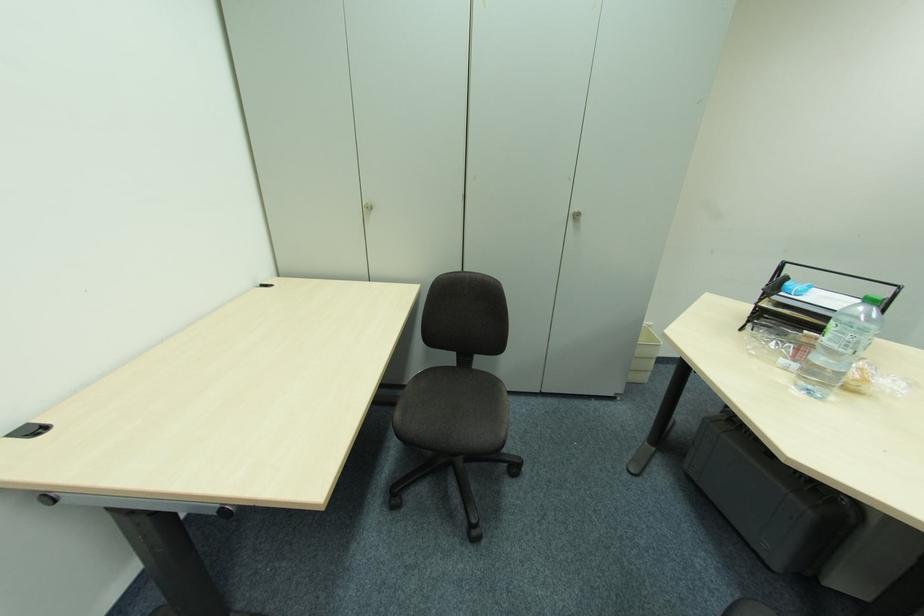
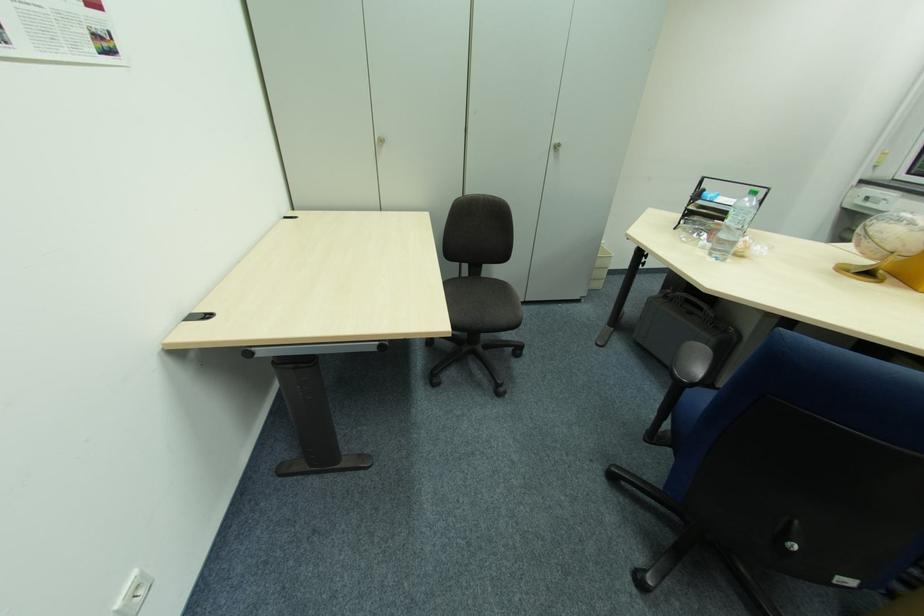
Find the pixel in the second image that matches (x=371, y=206) in the first image.

(382, 139)